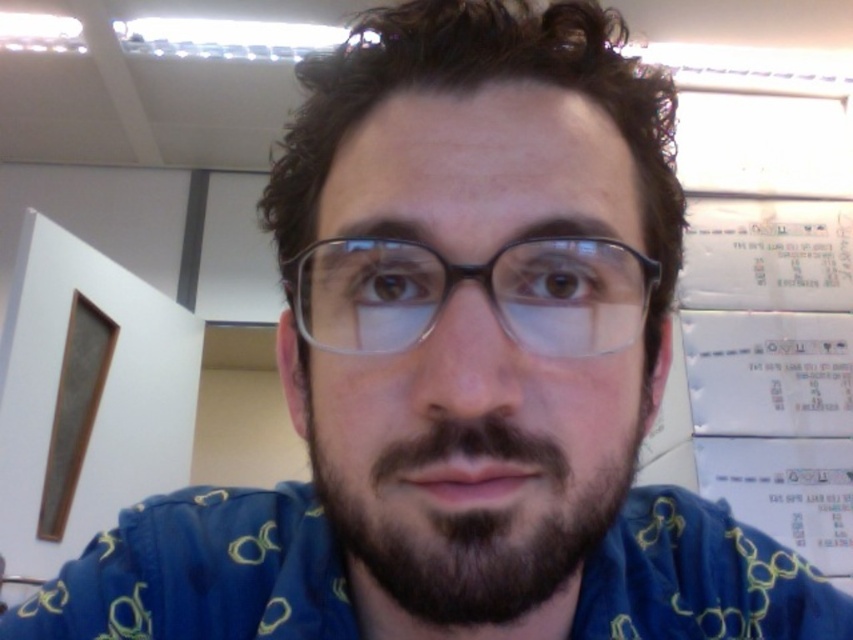
You are a photographer adjusting the focus on your camera. You want to ensure both the dark brown fuzzy beard at center and the transparent plastic glasses at center are in focus. Given that your camera can only focus on objects within a 2 inch range, will both objects be in focus?

The dark brown fuzzy beard at center and transparent plastic glasses at center are 2.03 inches apart. Since the distance between them exceeds the camera focus range of 2 inches, they cannot both be in focus simultaneously.

You are a photographer standing in the room and want to take a close up photo of the white paper at upper right. The camera you are using has a minimum focusing distance of 1.5 meters. Can you take the photo without moving closer?

The white paper at upper right is 1.89 meters away from the camera, which is beyond the minimum focusing distance of 1.5 meters. Therefore, you can take the close up photo without moving closer.